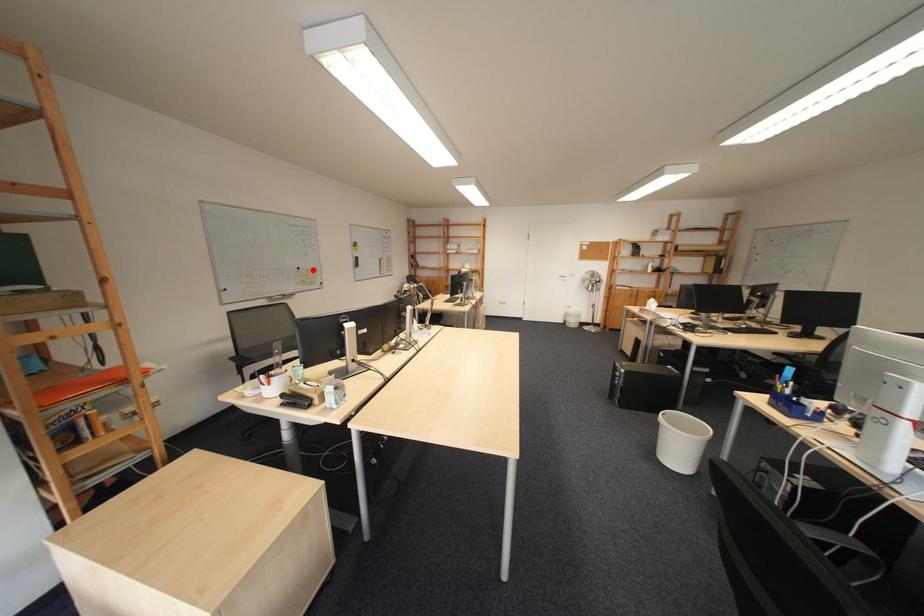
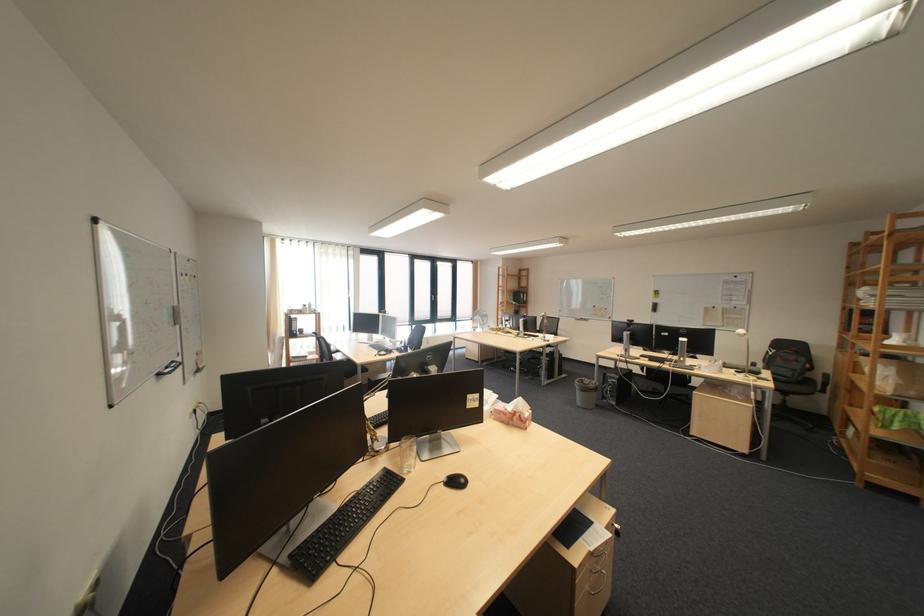
Locate, in the second image, the point that corresponds to the highlighted location in the first image.

(609, 308)